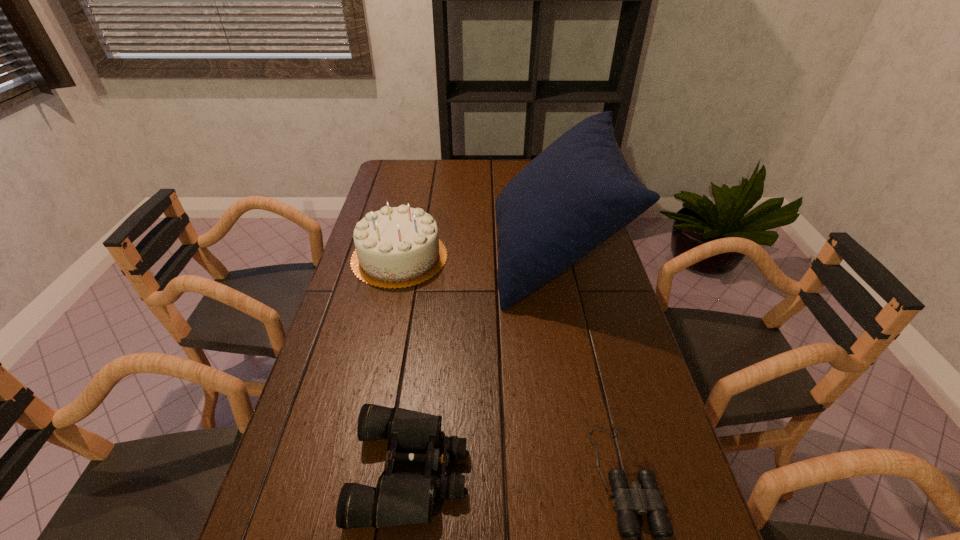
Where is `free point between the birthday cake and the tallest object`? Image resolution: width=960 pixels, height=540 pixels. free point between the birthday cake and the tallest object is located at coordinates (475, 256).

In order to click on free space that is in between the third shortest object and the cushion in this screenshot , I will do `click(475, 256)`.

Where is `the closest object to the left binoculars`? Image resolution: width=960 pixels, height=540 pixels. the closest object to the left binoculars is located at coordinates (644, 497).

Locate which object ranks in proximity to the shortest object. Please provide its 2D coordinates. Your answer should be formatted as a tuple, i.e. [(x, y)], where the tuple contains the x and y coordinates of a point satisfying the conditions above.

[(400, 498)]